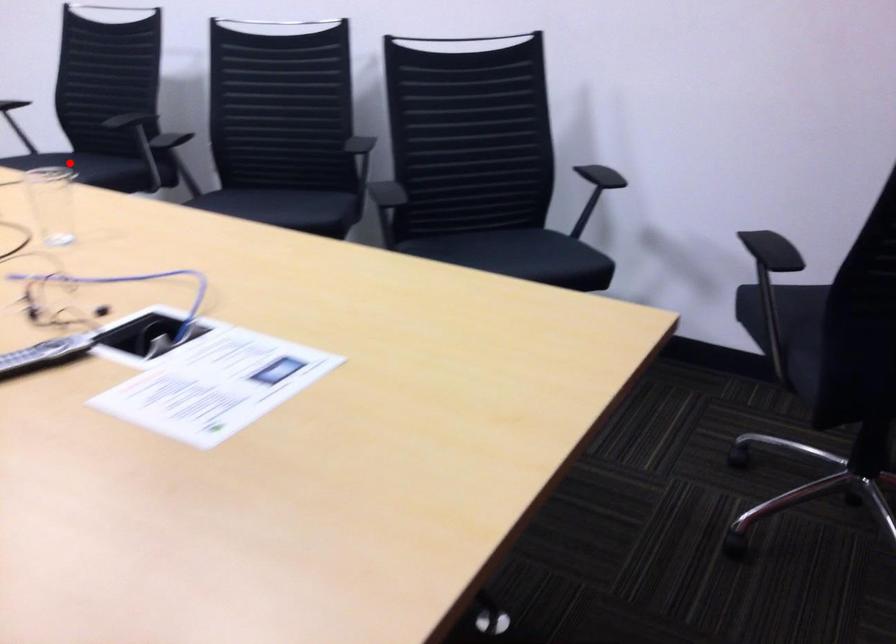
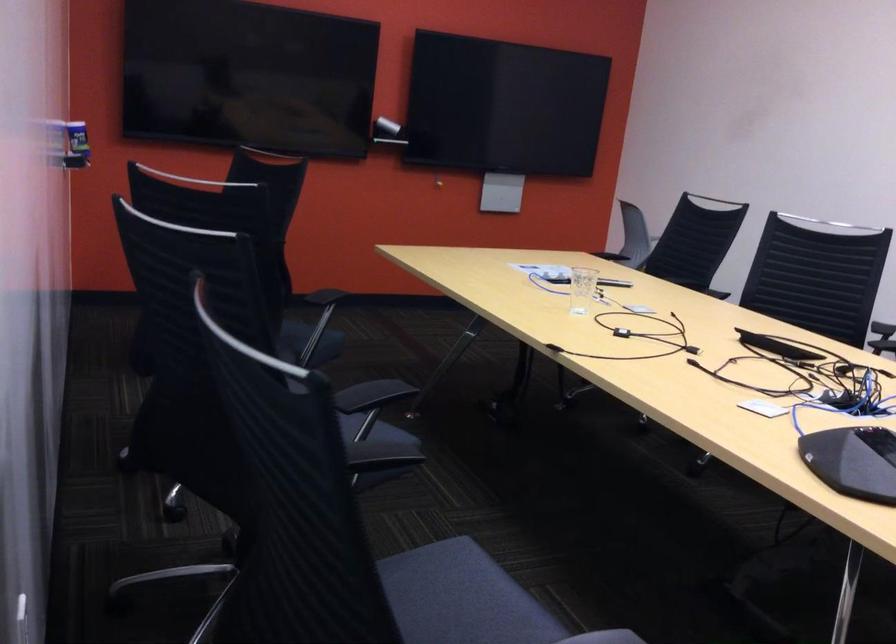
Question: I am providing you with two images of the same scene from different viewpoints. In image1, a red point is highlighted. Considering the same 3D point in image2, which of the following is correct?

Choices:
 (A) It is closer
 (B) It is farther

Answer: (A)